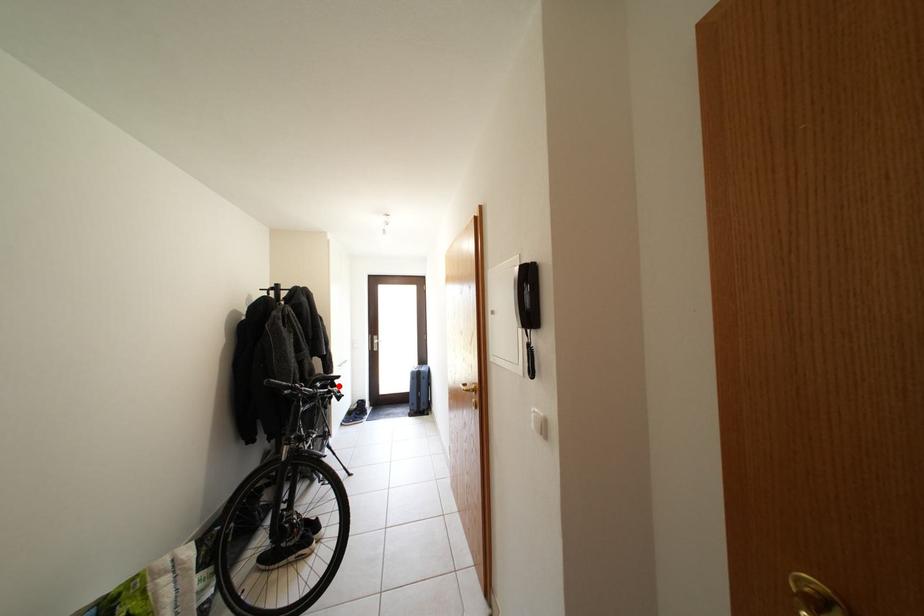
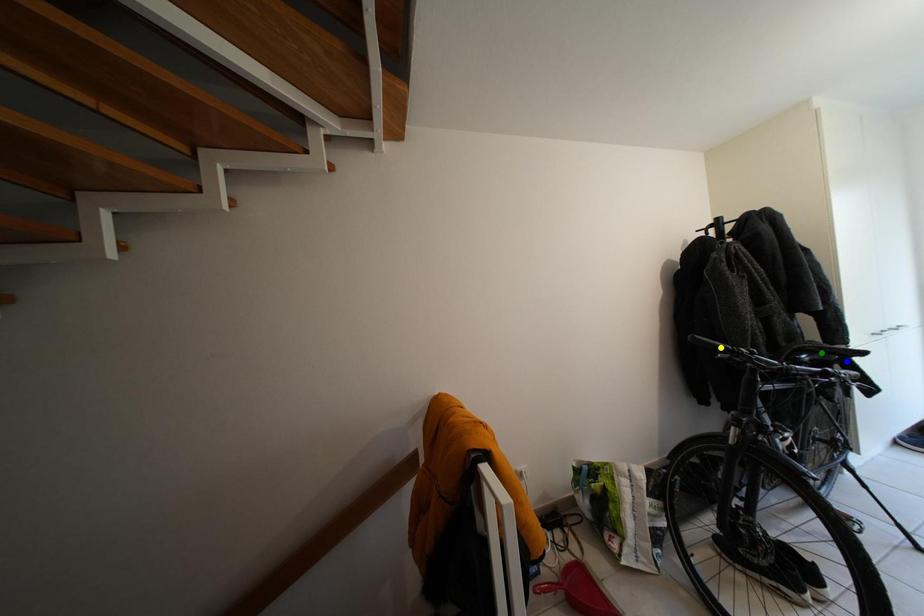
Question: I am providing you with two images of the same scene from different viewpoints. A red point is marked on the first image. You are given multiple points on the second image. In image 2, which mark is for the same physical point as the one in image 1?

Choices:
 (A) yellow point
 (B) blue point
 (C) green point

Answer: (B)